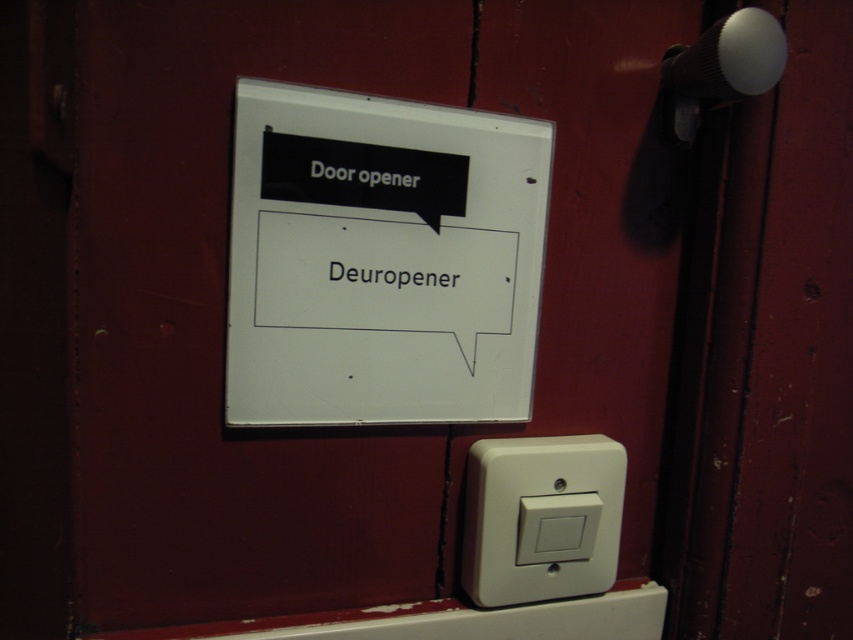
Question: Is black plastic deuropener at center to the right of white plastic door opener at upper center from the viewer's perspective?

Choices:
 (A) no
 (B) yes

Answer: (B)

Question: Is white plastic switch at lower center positioned behind white plastic door opener at upper center?

Choices:
 (A) no
 (B) yes

Answer: (B)

Question: Can you confirm if white plastic switch at lower center is thinner than black plastic deuropener at center?

Choices:
 (A) yes
 (B) no

Answer: (B)

Question: Which is nearer to the white plastic switch at lower center?

Choices:
 (A) black plastic deuropener at center
 (B) white plastic sign at upper center

Answer: (B)

Question: Among these points, which one is farthest from the camera?

Choices:
 (A) (519, 449)
 (B) (373, 182)
 (C) (346, 336)

Answer: (A)

Question: Among these points, which one is nearest to the camera?

Choices:
 (A) (351, 268)
 (B) (474, 285)
 (C) (395, 184)

Answer: (A)